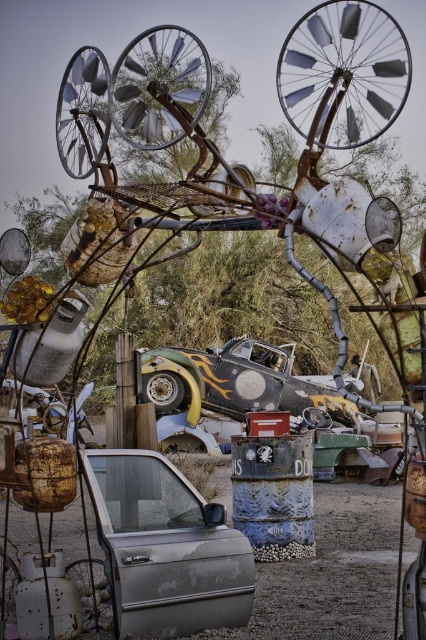
Does point (247, 612) come farther from viewer compared to point (227, 369)?

No, (247, 612) is closer to viewer.

This screenshot has width=426, height=640. Describe the element at coordinates (166, 548) in the screenshot. I see `silver metallic car door at center` at that location.

Identify the location of silver metallic car door at center. The height and width of the screenshot is (640, 426). (166, 548).